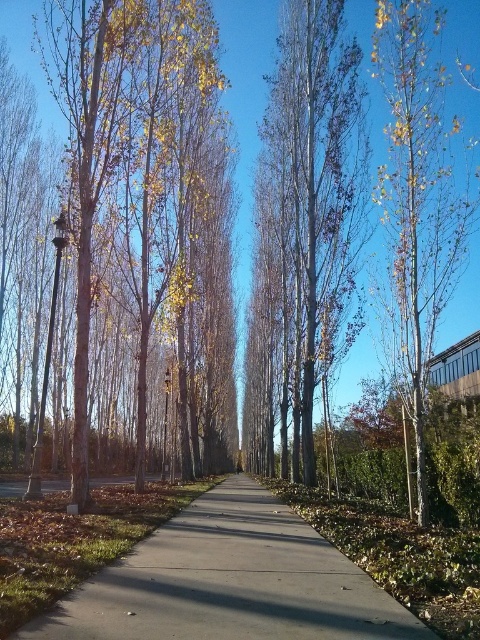
You are walking along the pathway and want to reach the smooth white birch at right. Which direction should you walk towards relative to the smooth silver birch tree at center?

You should walk towards the right direction relative to the smooth silver birch tree at center to reach the smooth white birch at right because the smooth white birch at right is positioned to the right side of the pathway.

You are standing at the entrance of the pathway and want to walk towards the building on the right. As you walk forward, will the smooth silver birch tree at center come into your view above or below the gray concrete sidewalk at center?

The smooth silver birch tree at center is located below the gray concrete sidewalk at center, so as you walk forward, the tree will appear below the sidewalk in your view.

You are an arborist measuring tree widths for a study. You observe the smooth silver birch tree at center and the smooth white birch at right. Which tree could potentially require a wider measurement tape when assessing their trunks?

The smooth silver birch tree at center might require a wider measurement tape because it is possibly wider than the smooth white birch at right according to the description.